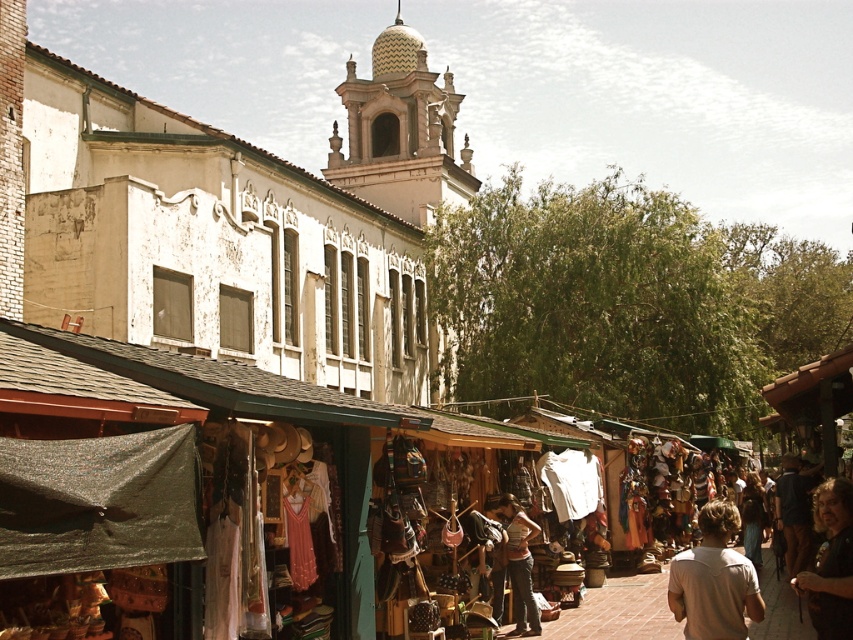
Between point (726, 618) and point (503, 506), which one is positioned in front?

Point (726, 618) is in front.

Between point (688, 630) and point (521, 545), which one is positioned in front?

Positioned in front is point (688, 630).

Image resolution: width=853 pixels, height=640 pixels. I want to click on light beige cotton shirt at lower right, so click(714, 580).

Is brown leather jacket at lower right thinner than light brown leather purse at center?

No.

Based on the photo, does brown leather jacket at lower right appear on the left side of light brown leather purse at center?

Incorrect, brown leather jacket at lower right is not on the left side of light brown leather purse at center.

Which is behind, point (848, 534) or point (521, 584)?

The point (521, 584) is behind.

Identify the location of brown leather jacket at lower right. This screenshot has height=640, width=853. (831, 563).

Does light beige cotton shirt at lower right have a smaller size compared to brown leather jacket at lower right?

Result: Actually, light beige cotton shirt at lower right might be larger than brown leather jacket at lower right.

Identify the location of light beige cotton shirt at lower right. (714, 580).

The height and width of the screenshot is (640, 853). What are the coordinates of `light beige cotton shirt at lower right` in the screenshot? It's located at (714, 580).